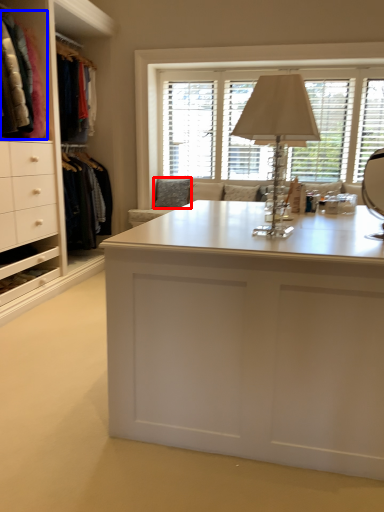
Question: Which object is further to the camera taking this photo, pillow (highlighted by a red box) or clothing (highlighted by a blue box)?

Choices:
 (A) pillow
 (B) clothing

Answer: (A)